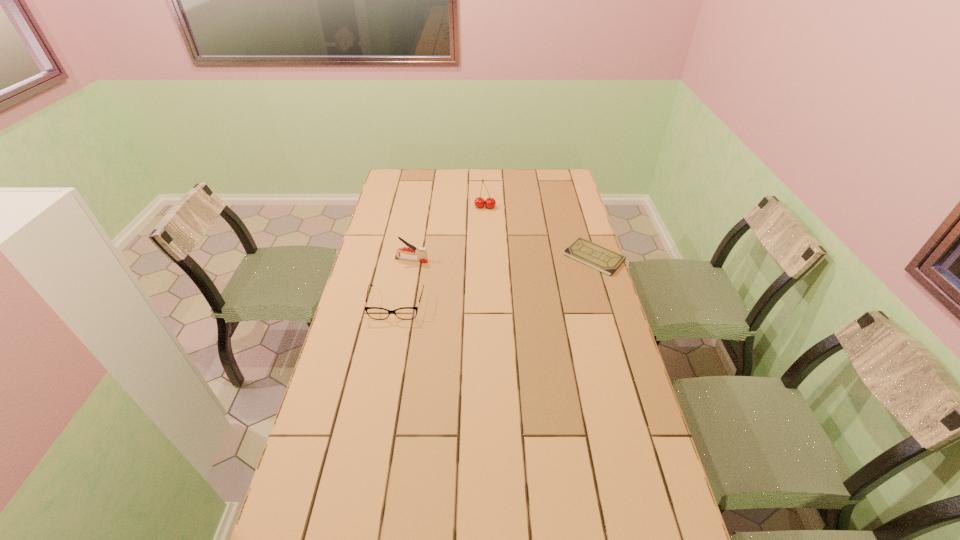
Locate an element on the screen. vacant space situated on the handle side of the second tallest object is located at coordinates (490, 269).

Identify the location of vacant space located 0.140m on the handle side of the second tallest object. [462, 265].

Find the location of a particular element. Image resolution: width=960 pixels, height=540 pixels. free space located with the stems of the tallest object pointing upwards is located at coordinates (482, 245).

This screenshot has width=960, height=540. Identify the location of vacant space located with the stems of the tallest object pointing upwards. (482, 245).

Identify the location of free space located with the stems of the tallest object pointing upwards. (484, 223).

The image size is (960, 540). In order to click on spectacles at the left edge in this screenshot , I will do `click(405, 313)`.

I want to click on stapler that is at the left edge, so click(421, 252).

The height and width of the screenshot is (540, 960). I want to click on object at the right edge, so click(x=591, y=254).

This screenshot has height=540, width=960. In order to click on vacant space at the far edge of the desktop in this screenshot , I will do `click(484, 171)`.

In order to click on vacant region at the near edge of the desktop in this screenshot , I will do `click(435, 510)`.